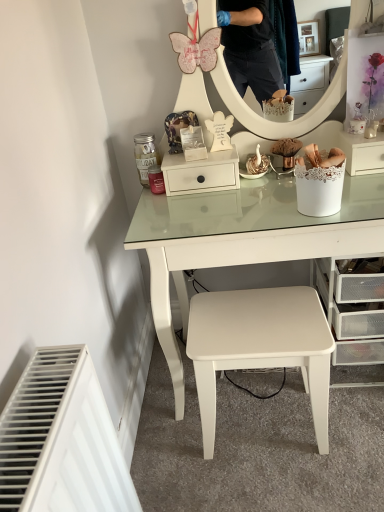
Image resolution: width=384 pixels, height=512 pixels. In order to click on free space above white matte drawer at center, placed as the second shelf when sorted from right to left (from a real-world perspective) in this screenshot , I will do `click(195, 153)`.